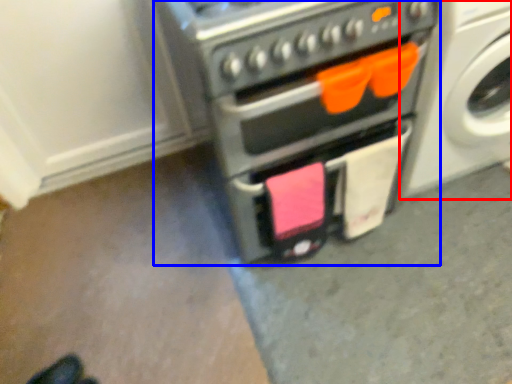
Question: Which object is closer to the camera taking this photo, washing machine (highlighted by a red box) or home appliance (highlighted by a blue box)?

Choices:
 (A) washing machine
 (B) home appliance

Answer: (B)